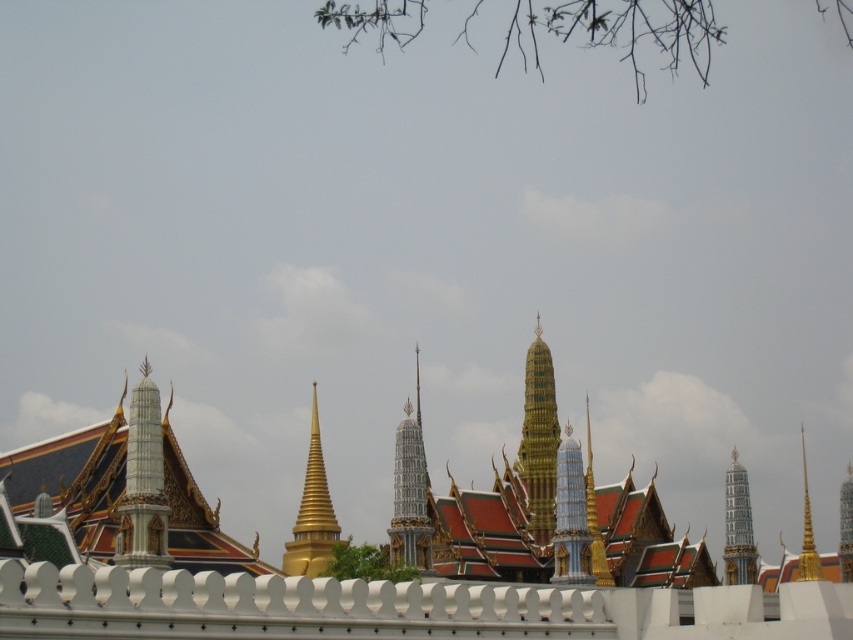
Question: Is gold polished spire at center to the left of gold textured spire at center right from the viewer's perspective?

Choices:
 (A) yes
 (B) no

Answer: (A)

Question: Is gold metallic spire at center-right wider than gold/golden metallic spire at right?

Choices:
 (A) no
 (B) yes

Answer: (A)

Question: Considering the real-world distances, which object is farthest from the gold/golden/temple spire at center?

Choices:
 (A) white matte fence at lower center
 (B) white marble spire at center
 (C) white glossy spire at center

Answer: (A)

Question: Which object appears closest to the camera in this image?

Choices:
 (A) white matte fence at lower center
 (B) gold metallic spire at center-right

Answer: (A)

Question: Which object appears closest to the camera in this image?

Choices:
 (A) gold polished spire at center
 (B) gold/golden metallic spire at right

Answer: (A)

Question: Is white matte fence at lower center bigger than gold/golden/temple spire at center?

Choices:
 (A) yes
 (B) no

Answer: (A)